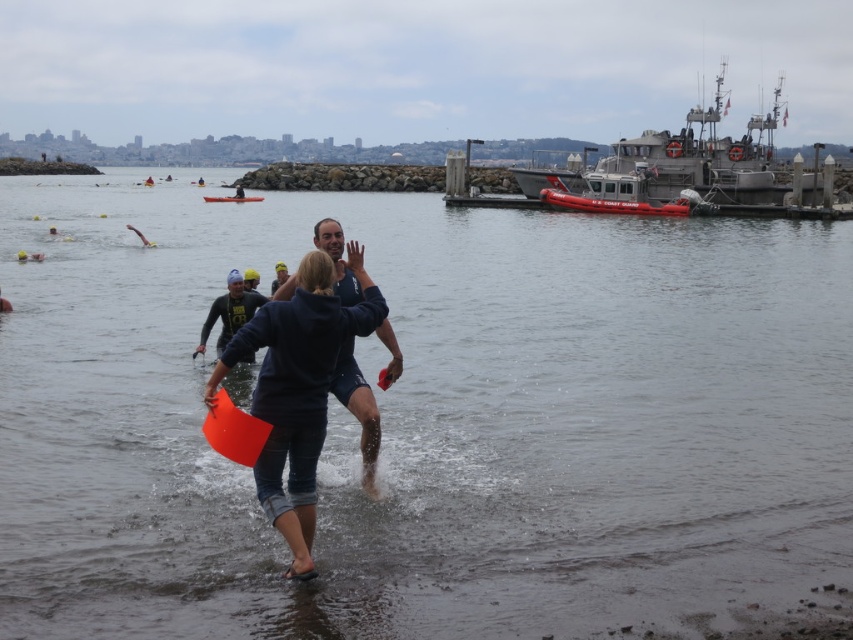
Who is positioned more to the left, clear water at center or orange plastic kayak at center?

Positioned to the left is orange plastic kayak at center.

Who is taller, clear water at center or orange plastic kayak at center?

clear water at center

Find the location of a particular element. Image resolution: width=853 pixels, height=640 pixels. clear water at center is located at coordinates (425, 419).

Locate an element on the screen. This screenshot has height=640, width=853. clear water at center is located at coordinates (425, 419).

Does dark blue hoodie at center appear under dark blue fabric at center?

Yes.

The image size is (853, 640). Describe the element at coordinates (299, 387) in the screenshot. I see `dark blue hoodie at center` at that location.

Locate an element on the screen. Image resolution: width=853 pixels, height=640 pixels. dark blue hoodie at center is located at coordinates (299, 387).

Is dark blue fabric at center smaller than orange plastic kayak at center?

Actually, dark blue fabric at center might be larger than orange plastic kayak at center.

Does point (354, 280) come farther from viewer compared to point (245, 202)?

No, (354, 280) is closer to viewer.

Is point (399, 369) more distant than point (228, 202)?

No, it is not.

Identify the location of dark blue fabric at center. The image size is (853, 640). (358, 410).